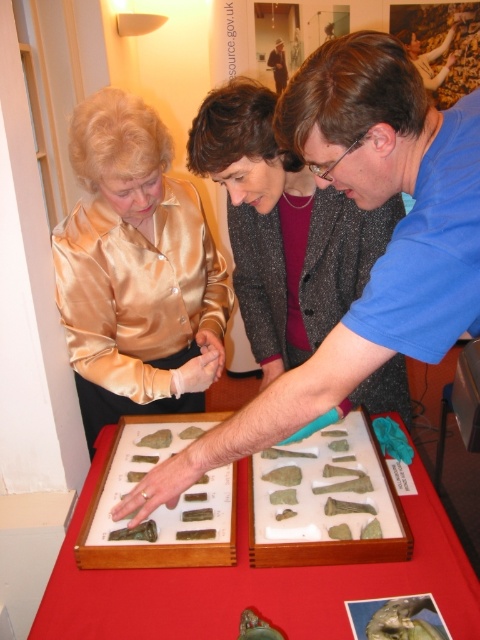
You are standing in front of the display table and notice two points marked on the image. The first point is at coordinates point (x=131, y=243) and the second is at point (x=230, y=246). Which point is closer to you?

Point (x=131, y=243) is closer to the viewer than point (x=230, y=246).

You are an observer looking at the group of people around the display table. You notice the blue matte shirt at center and the satin gold blouse at upper left. Which of these two items is positioned lower in the image?

The blue matte shirt at center is located below the satin gold blouse at upper left, so it is positioned lower in the image.

Based on the scene description, which object is smaller in size between the satin gold blouse at upper left and the silky gold blouse at center?

The satin gold blouse at upper left is smaller in size compared to the silky gold blouse at center according to the description.